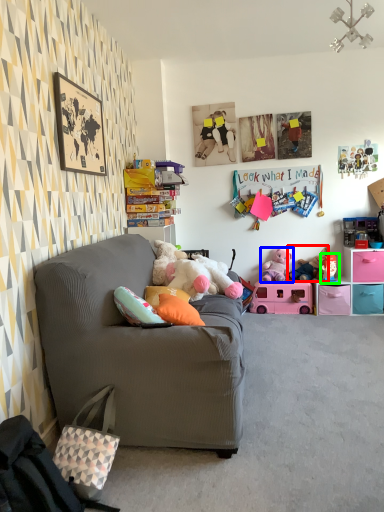
Question: Considering the real-world distances, which object is closest to toy (highlighted by a red box)? toy (highlighted by a blue box) or toy (highlighted by a green box).

Choices:
 (A) toy
 (B) toy

Answer: (B)